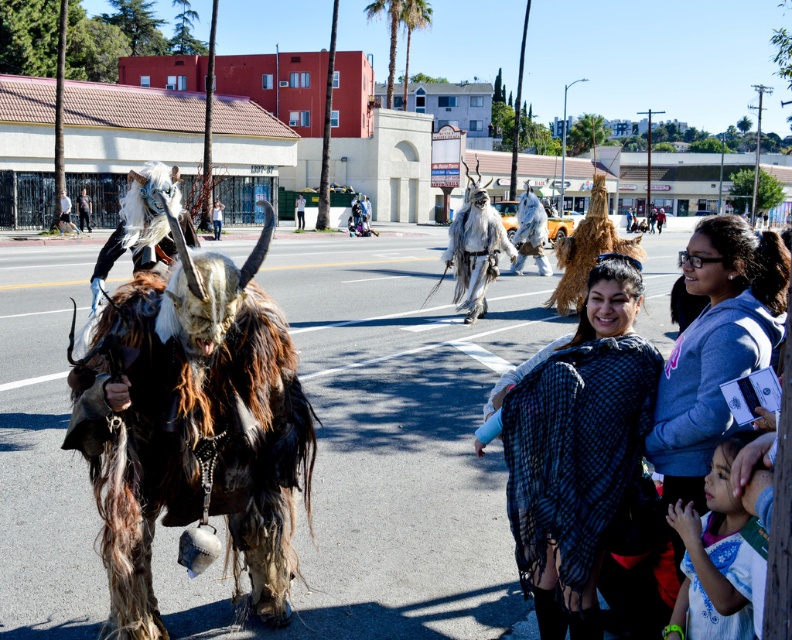
Based on the photo, you are a photographer trying to capture a photo of the white fur costume at lower right and the white fur costume at center. Since both are in the same scene, which one is more to the right?

The white fur costume at lower right is positioned on the right side of the white fur costume at center, so it is more to the right.

You are a photographer trying to capture both the white fur costume at lower right and the white fur costume at center in a single shot. However, you notice that one of them is blocking the view of the other. Which costume is obstructing the view of the other?

The white fur costume at lower right is positioned under the white fur costume at center, so the white fur costume at center is blocking the view of the white fur costume at lower right.